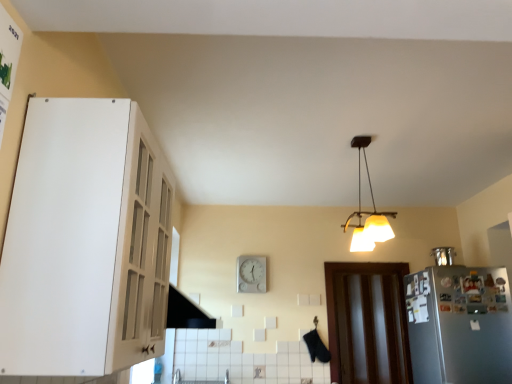
Question: Could you tell me if metallic refrigerator at right is turned towards brown wooden door at lower right?

Choices:
 (A) no
 (B) yes

Answer: (A)

Question: From a real-world perspective, is metallic refrigerator at right on top of brown wooden door at lower right?

Choices:
 (A) no
 (B) yes

Answer: (B)

Question: Is brown wooden door at lower right located within metallic refrigerator at right?

Choices:
 (A) yes
 (B) no

Answer: (B)

Question: From the image's perspective, is metallic refrigerator at right over brown wooden door at lower right?

Choices:
 (A) yes
 (B) no

Answer: (A)

Question: Is metallic refrigerator at right outside brown wooden door at lower right?

Choices:
 (A) no
 (B) yes

Answer: (B)

Question: From the image's perspective, is brown wooden door at lower right above or below satin silver refrigerator at right?

Choices:
 (A) below
 (B) above

Answer: (A)

Question: In terms of size, does brown wooden door at lower right appear bigger or smaller than satin silver refrigerator at right?

Choices:
 (A) big
 (B) small

Answer: (B)

Question: From their relative heights in the image, would you say brown wooden door at lower right is taller or shorter than satin silver refrigerator at right?

Choices:
 (A) tall
 (B) short

Answer: (A)

Question: From a real-world perspective, is brown wooden door at lower right above or below satin silver refrigerator at right?

Choices:
 (A) above
 (B) below

Answer: (A)

Question: In terms of height, does metallic refrigerator at right look taller or shorter compared to satin silver refrigerator at right?

Choices:
 (A) short
 (B) tall

Answer: (A)

Question: Visually, is metallic refrigerator at right positioned to the left or to the right of satin silver refrigerator at right?

Choices:
 (A) left
 (B) right

Answer: (A)

Question: From a real-world perspective, is metallic refrigerator at right physically located above or below satin silver refrigerator at right?

Choices:
 (A) below
 (B) above

Answer: (B)

Question: Is metallic refrigerator at right bigger or smaller than satin silver refrigerator at right?

Choices:
 (A) small
 (B) big

Answer: (A)

Question: Looking at the image, does white plastic clock at center seem bigger or smaller compared to satin silver refrigerator at right?

Choices:
 (A) big
 (B) small

Answer: (B)

Question: Considering the positions of white plastic clock at center and satin silver refrigerator at right in the image, is white plastic clock at center taller or shorter than satin silver refrigerator at right?

Choices:
 (A) tall
 (B) short

Answer: (B)